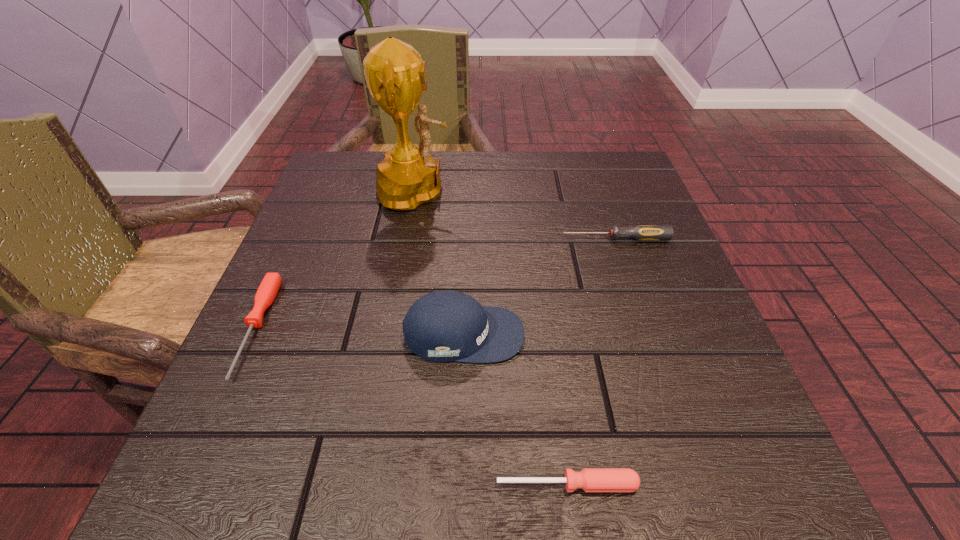
Where is `the tallest object`? This screenshot has height=540, width=960. the tallest object is located at coordinates (396, 75).

You are a GUI agent. You are given a task and a screenshot of the screen. Output one action in this format:
    pyautogui.click(x=<x>, y=<y>)
    Task: Click on the farthest object
    Image resolution: width=960 pixels, height=540 pixels.
    Given the screenshot: What is the action you would take?
    pyautogui.click(x=396, y=75)

Where is `baseball cap`? This screenshot has height=540, width=960. baseball cap is located at coordinates (441, 326).

Locate an element on the screen. the farthest screwdriver is located at coordinates (642, 233).

Where is `the third shortest object`? Image resolution: width=960 pixels, height=540 pixels. the third shortest object is located at coordinates (642, 233).

Where is `the second nearest screwdriver`? The height and width of the screenshot is (540, 960). the second nearest screwdriver is located at coordinates (269, 287).

The height and width of the screenshot is (540, 960). Identify the location of the leftmost object. (269, 287).

Locate an element on the screen. This screenshot has height=540, width=960. the nearest screwdriver is located at coordinates [589, 479].

Find the location of a particular element. This screenshot has width=960, height=540. free space located on the front side of the farthest object is located at coordinates (514, 191).

Image resolution: width=960 pixels, height=540 pixels. I want to click on vacant space located on the front-facing side of the second tallest object, so click(599, 334).